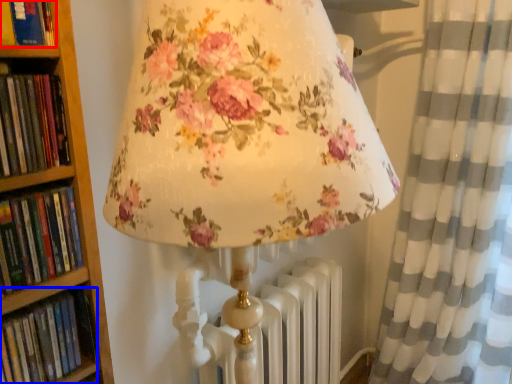
Question: Which point is closer to the camera, book (highlighted by a red box) or book (highlighted by a blue box)?

Choices:
 (A) book
 (B) book

Answer: (A)